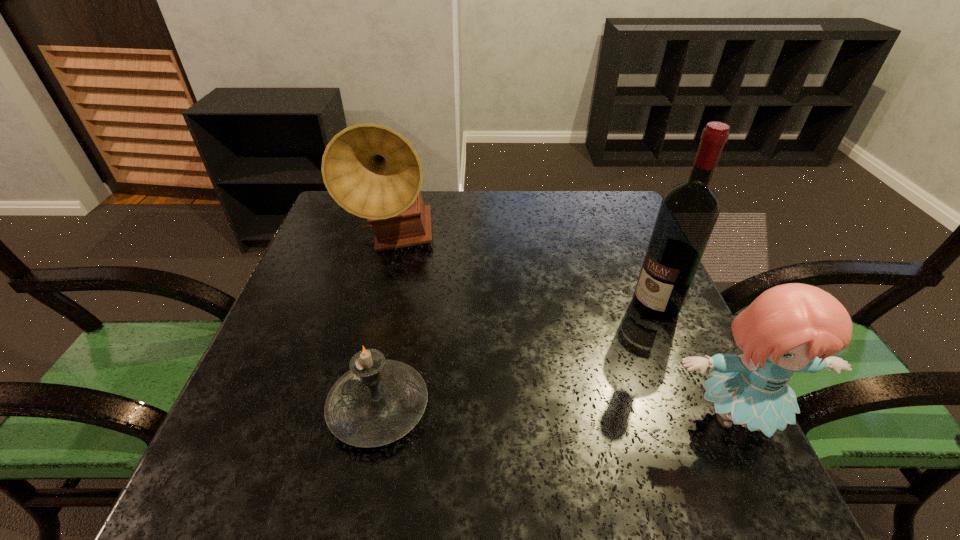
Locate an element on the screen. This screenshot has width=960, height=540. vacant region at the far edge of the desktop is located at coordinates (493, 227).

The width and height of the screenshot is (960, 540). In the image, there is a desktop. Identify the location of free space at the near edge. (566, 420).

You are a GUI agent. You are given a task and a screenshot of the screen. Output one action in this format:
    pyautogui.click(x=<x>, y=<y>)
    Task: Click on the free space at the left edge
    This screenshot has height=540, width=960.
    Given the screenshot: What is the action you would take?
    pyautogui.click(x=324, y=360)

Find the location of a particular element. The height and width of the screenshot is (540, 960). vacant area at the right edge is located at coordinates (649, 392).

The width and height of the screenshot is (960, 540). In the image, there is a desktop. Identify the location of free space at the far right corner. (581, 197).

Identify the location of vacant point located between the second farthest object and the candle. (517, 357).

Find the location of a particular element. The width and height of the screenshot is (960, 540). free spot between the doll and the shortest object is located at coordinates [x=557, y=413].

Where is `free space between the doll and the shortest object`? Image resolution: width=960 pixels, height=540 pixels. free space between the doll and the shortest object is located at coordinates 557,413.

Locate an element on the screen. The width and height of the screenshot is (960, 540). free space between the alcohol and the candle is located at coordinates (517, 357).

Where is `vacant space in between the phonograph record and the second farthest object`? This screenshot has width=960, height=540. vacant space in between the phonograph record and the second farthest object is located at coordinates (525, 274).